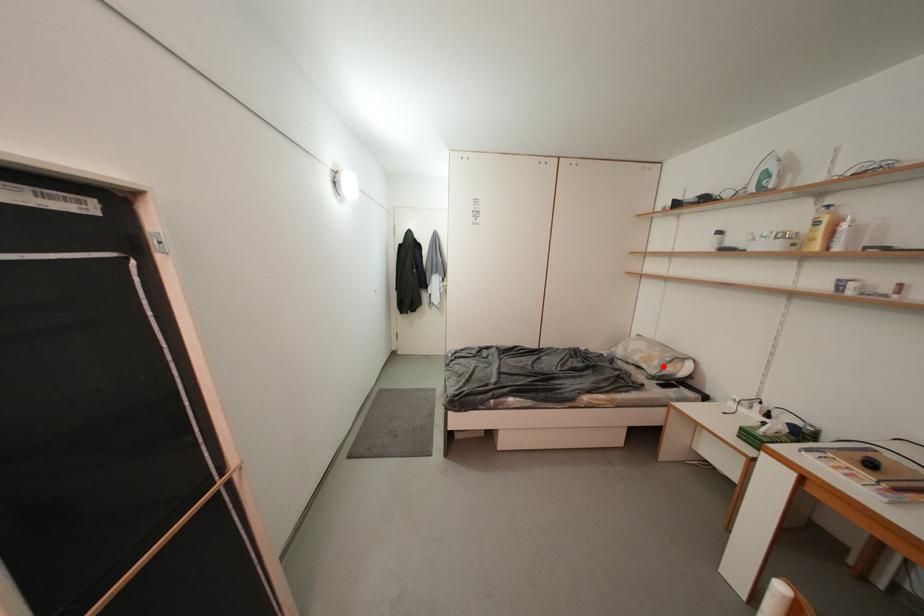
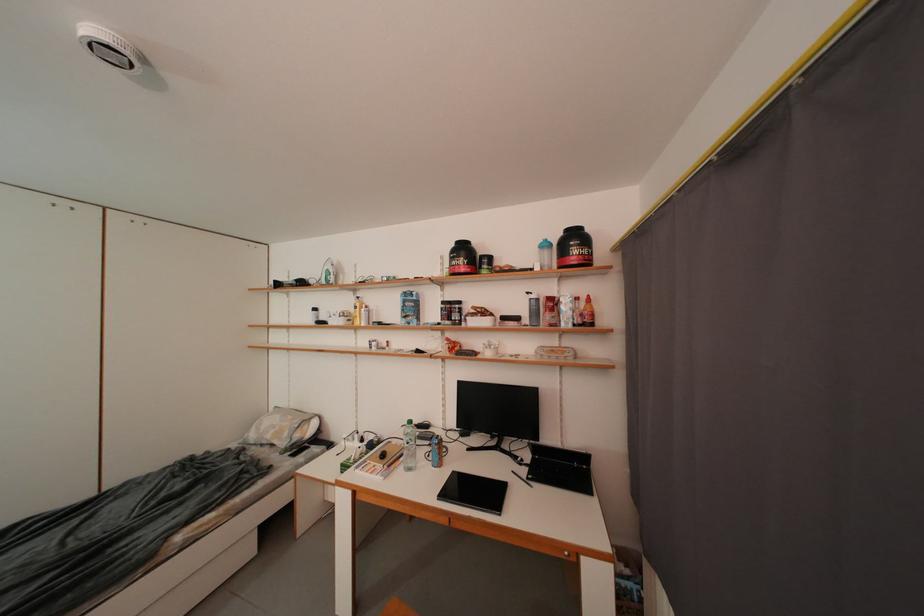
Question: I am providing you with two images of the same scene from different viewpoints. Given a red point in image1, look at the same physical point in image2. Is it:

Choices:
 (A) Closer to the viewpoint
 (B) Farther from the viewpoint

Answer: (B)